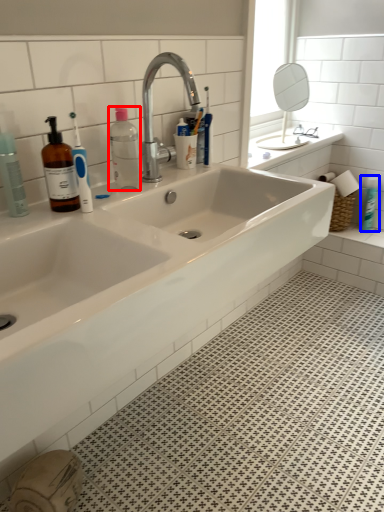
Question: Among these objects, which one is nearest to the camera, bottle (highlighted by a red box) or toiletry (highlighted by a blue box)?

Choices:
 (A) bottle
 (B) toiletry

Answer: (A)